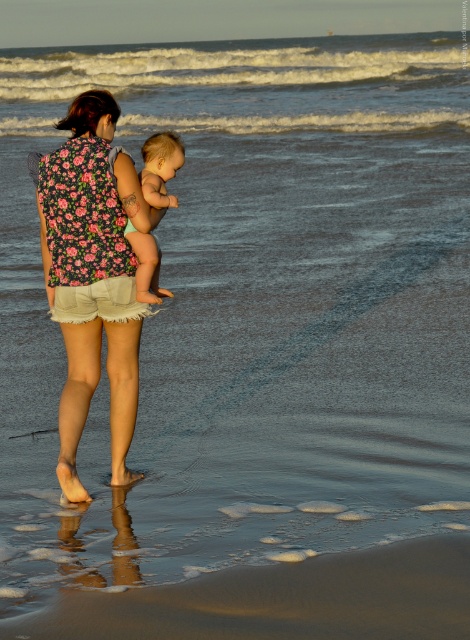
Question: Can you confirm if sandy brown at lower center is bigger than soft beige skin at center?

Choices:
 (A) yes
 (B) no

Answer: (A)

Question: Which of the following is the farthest from the observer?

Choices:
 (A) (70, 467)
 (B) (156, 168)
 (C) (410, 547)

Answer: (B)

Question: Which of the following is the farthest from the observer?

Choices:
 (A) (146, 269)
 (B) (363, 589)

Answer: (A)

Question: Is sandy brown at lower center smaller than floral fabric top at center?

Choices:
 (A) no
 (B) yes

Answer: (B)

Question: Where is floral fabric top at center located in relation to soft beige skin at center in the image?

Choices:
 (A) above
 (B) below

Answer: (B)

Question: Considering the real-world distances, which object is farthest from the sandy brown at lower center?

Choices:
 (A) soft beige skin at center
 (B) floral fabric top at center

Answer: (A)